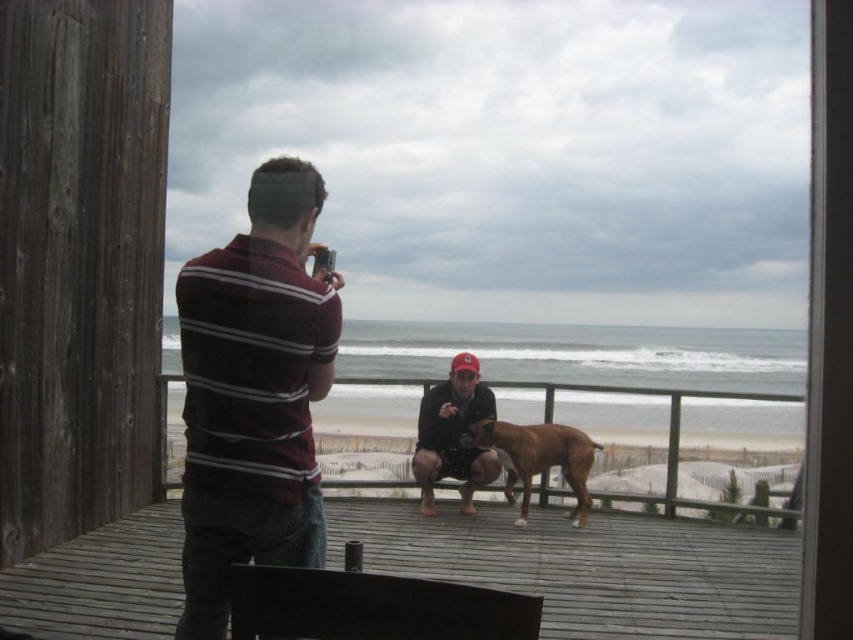
Question: Does maroon striped shirt at left appear on the left side of matte black jacket at center?

Choices:
 (A) no
 (B) yes

Answer: (B)

Question: Which point appears closest to the camera in this image?

Choices:
 (A) (253, 432)
 (B) (547, 460)
 (C) (770, 531)

Answer: (A)

Question: Does wooden deck at center appear under brown glossy dog at center?

Choices:
 (A) yes
 (B) no

Answer: (A)

Question: Which object appears closest to the camera in this image?

Choices:
 (A) maroon striped shirt at left
 (B) matte black jacket at center
 (C) wooden deck at center

Answer: (A)

Question: Which is nearer to the matte black jacket at center?

Choices:
 (A) brown glossy dog at center
 (B) maroon striped shirt at left

Answer: (A)

Question: Is maroon striped shirt at left above matte black jacket at center?

Choices:
 (A) yes
 (B) no

Answer: (A)